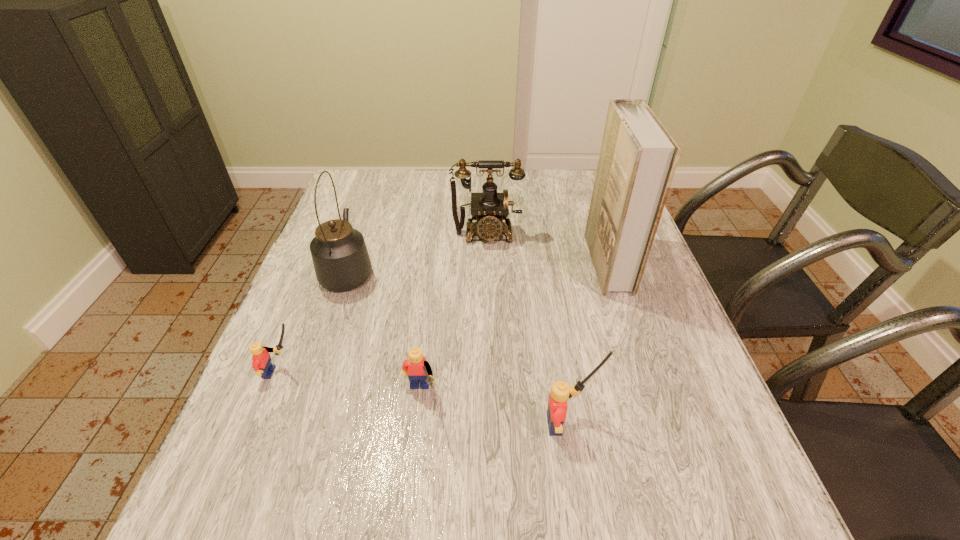
This screenshot has width=960, height=540. I want to click on object that is at the near edge, so click(560, 392).

This screenshot has width=960, height=540. What are the coordinates of `Lego that is at the left edge` in the screenshot? It's located at (262, 364).

Identify the location of kettle that is at the left edge. The height and width of the screenshot is (540, 960). (341, 261).

You are a GUI agent. You are given a task and a screenshot of the screen. Output one action in this format:
    pyautogui.click(x=<x>, y=<y>)
    Task: Click on the object that is positioned at the right edge
    The width and height of the screenshot is (960, 540).
    Given the screenshot: What is the action you would take?
    pyautogui.click(x=638, y=158)

I want to click on free space at the far edge of the desktop, so click(x=483, y=174).

Where is `vacant region at the near edge of the desktop`? This screenshot has height=540, width=960. vacant region at the near edge of the desktop is located at coordinates (409, 429).

Where is `free space at the left edge`? Image resolution: width=960 pixels, height=540 pixels. free space at the left edge is located at coordinates (279, 379).

Identify the location of free space at the right edge of the desktop. The image size is (960, 540). (654, 300).

Image resolution: width=960 pixels, height=540 pixels. Find the location of `vacant space at the far left corner of the desktop`. vacant space at the far left corner of the desktop is located at coordinates (355, 206).

At what (x,y) coordinates should I click in order to perform the action: click on free space at the near right corner of the desktop. Please return your answer as a coordinate pair (x, y). Image resolution: width=960 pixels, height=540 pixels. Looking at the image, I should click on (733, 447).